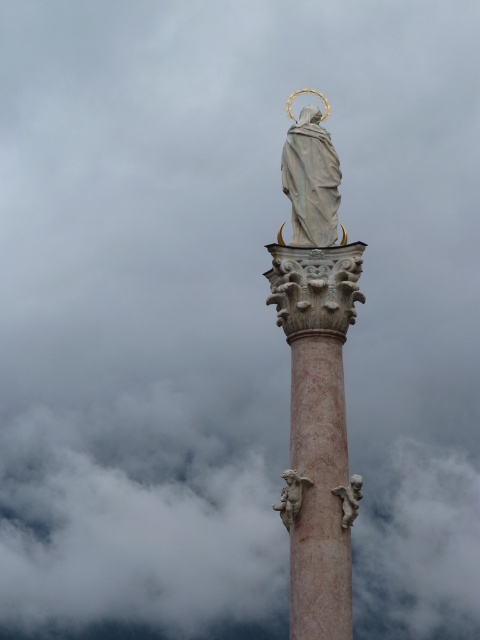
You are an architect designing a new plaza and want to place a new sculpture between the white marble statue at center and the pink marble cherub at center. The sculpture requires a space that is narrower than the wider of the two. Which existing statue should the sculpture be placed next to?

The sculpture should be placed next to the white marble statue at center because it might be wider than the pink marble cherub at center, so the required space would be narrower than the wider statue.

You are an architect designing a miniature model of this scene. The statue and the cherub must be scaled down proportionally. If the original white marble statue at center is 10 meters tall, how tall should the pink marble cherub at center be in the model if the scale is 1 cm to 1 meter?

The white marble statue at center is much taller than the pink marble cherub at center. If the original statue is 10 meters tall, the cherub must be significantly shorter. To maintain proportion, the model cherub should be scaled down to a height that reflects this difference. However, without exact measurements, an approximate estimate would be necessary. For example, if the cherub is about 1 meter tall originally, the model would be 1 cm. But since the statue is 10 meters, the model statue is 10 cm. The 1